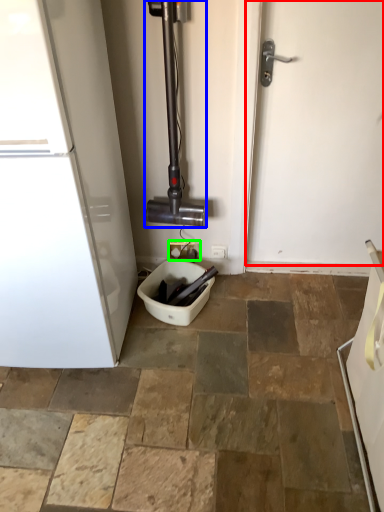
Question: Which is farther away from door (highlighted by a red box)? pipe (highlighted by a blue box) or electric outlet (highlighted by a green box)?

Choices:
 (A) pipe
 (B) electric outlet

Answer: (B)